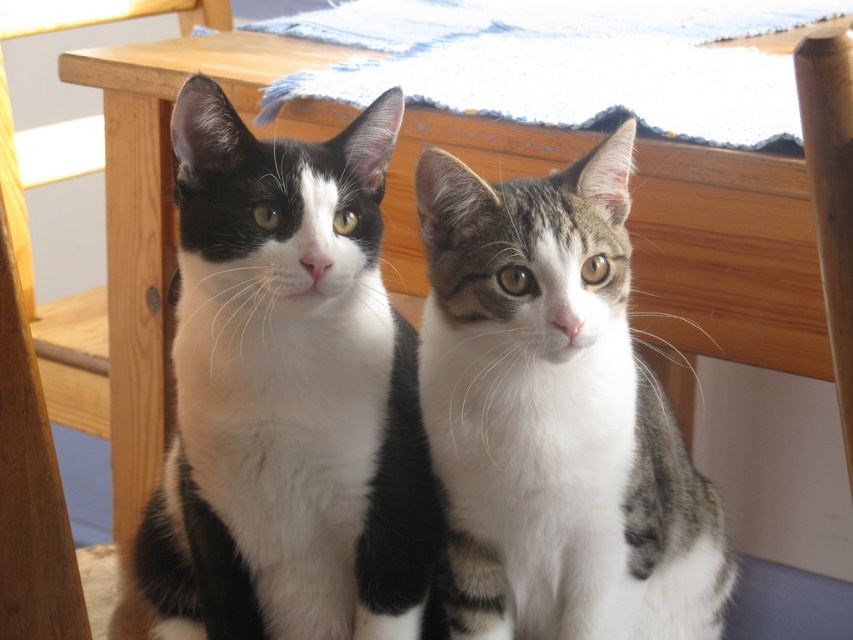
The image size is (853, 640). What do you see at coordinates (287, 394) in the screenshot? I see `black and white fur cat at center` at bounding box center [287, 394].

Locate an element on the screen. This screenshot has width=853, height=640. black and white fur cat at center is located at coordinates (287, 394).

This screenshot has height=640, width=853. Describe the element at coordinates (26, 220) in the screenshot. I see `wooden chair at left` at that location.

Looking at this image, is wooden chair at left taller than wooden chair at right?

Yes, wooden chair at left is taller than wooden chair at right.

Does point (201, 6) come closer to viewer compared to point (802, 45)?

That is False.

What are the coordinates of `wooden chair at left` in the screenshot? It's located at (26, 220).

Which is behind, point (670, 572) or point (844, 432)?

The point (670, 572) is more distant.

Who is lower down, tabby fur cat at center or wooden chair at right?

Positioned lower is tabby fur cat at center.

Is point (683, 524) farther from camera compared to point (825, 40)?

Yes, point (683, 524) is behind point (825, 40).

The image size is (853, 640). I want to click on tabby fur cat at center, so click(555, 417).